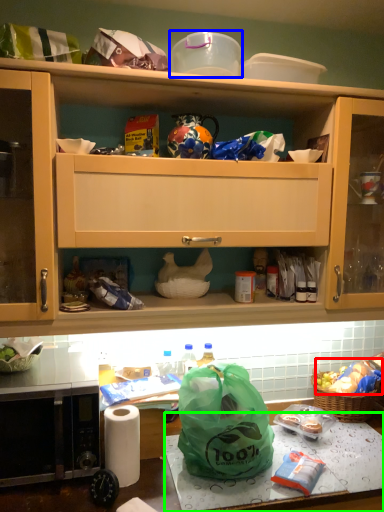
Question: Which object is the closest to the food (highlighted by a red box)? Choose among these: appliance (highlighted by a blue box) or table (highlighted by a green box).

Choices:
 (A) appliance
 (B) table

Answer: (B)